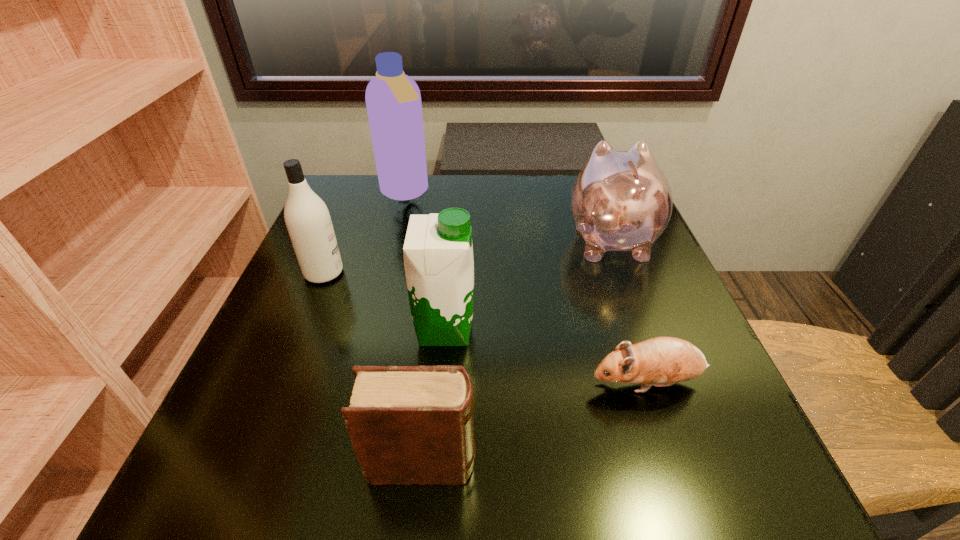
What are the coordinates of `vacant point located between the right shampoo and the hamster` in the screenshot? It's located at (526, 288).

Find the location of a particular element. The height and width of the screenshot is (540, 960). object that is the fourth nearest to the third nearest object is located at coordinates (620, 201).

This screenshot has width=960, height=540. I want to click on object identified as the fifth closest to the tallest object, so click(408, 425).